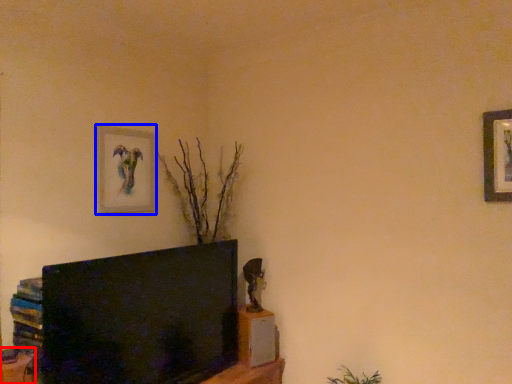
Question: Among these objects, which one is nearest to the camera, furniture (highlighted by a red box) or picture frame (highlighted by a blue box)?

Choices:
 (A) furniture
 (B) picture frame

Answer: (A)